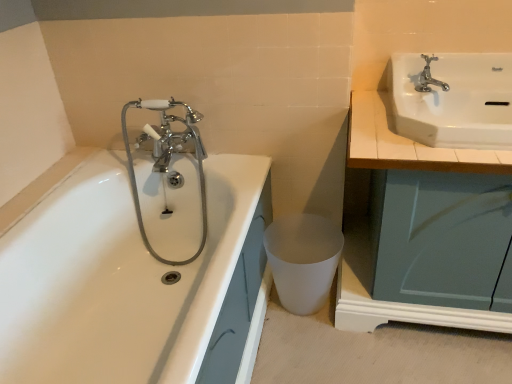
Measure the distance between point (356, 146) and camera.

Point (356, 146) and camera are 1.18 meters apart from each other.

At what (x,y) coordinates should I click in order to perform the action: click on white wood countertop at upper right. Please return your answer as a coordinate pair (x, y). Looking at the image, I should click on (406, 144).

This screenshot has width=512, height=384. In order to click on white matte plastic at lower center in this screenshot , I will do `click(303, 260)`.

Measure the distance between white glossy bathtub at left and camera.

They are 32.67 inches apart.

This screenshot has height=384, width=512. Describe the element at coordinates (139, 267) in the screenshot. I see `white glossy bathtub at left` at that location.

You are a GUI agent. You are given a task and a screenshot of the screen. Output one action in this format:
    pyautogui.click(x=<x>, y=<y>)
    Task: Click on the chrome metallic faucet at upper right
    
    Given the screenshot: What is the action you would take?
    pyautogui.click(x=429, y=77)

Find the location of a particular element. chrome/metallic faucet at left is located at coordinates (168, 159).

Locate an element on the screen. The image size is (512, 384). white wood countertop at upper right is located at coordinates (406, 144).

Is the surface of chrome metallic faucet at upper right in direct contact with white glossy sink at upper right?

There is a gap between chrome metallic faucet at upper right and white glossy sink at upper right.

Which is more distant, (415, 88) or (404, 80)?

The point (404, 80) is behind.

From a real-world perspective, is chrome metallic faucet at upper right located beneath white glossy sink at upper right?

Actually, chrome metallic faucet at upper right is physically above white glossy sink at upper right in the real world.

Relative to white glossy sink at upper right, is chrome metallic faucet at upper right in front or behind?

Visually, chrome metallic faucet at upper right is located behind white glossy sink at upper right.

Is chrome/metallic faucet at left closer to the viewer compared to white matte plastic at lower center?

Yes, it is.

From a real-world perspective, who is located higher, chrome/metallic faucet at left or white matte plastic at lower center?

chrome/metallic faucet at left is physically above.

From the image's perspective, which is above, chrome/metallic faucet at left or white matte plastic at lower center?

chrome/metallic faucet at left, from the image's perspective.

Image resolution: width=512 pixels, height=384 pixels. Find the location of `bathtub located in front of the white wood countertop at upper right`. bathtub located in front of the white wood countertop at upper right is located at coordinates (139, 267).

Can you confirm if white glossy bathtub at left is bigger than white wood countertop at upper right?

Yes.

Can you confirm if white glossy bathtub at left is positioned to the right of white wood countertop at upper right?

No, white glossy bathtub at left is not to the right of white wood countertop at upper right.

Between point (49, 212) and point (383, 312), which one is positioned in front?

The point (49, 212) is closer to the camera.

From their relative heights in the image, would you say white glossy bathtub at left is taller or shorter than white matte plastic at lower center?

In the image, white glossy bathtub at left appears to be taller than white matte plastic at lower center.

Is white glossy bathtub at left in contact with white matte plastic at lower center?

No.

From the image's perspective, is white glossy bathtub at left located above or below white matte plastic at lower center?

From the image's perspective, white glossy bathtub at left appears below white matte plastic at lower center.

From a real-world perspective, is white glossy bathtub at left physically located above or below white matte plastic at lower center?

white glossy bathtub at left is situated higher than white matte plastic at lower center in the real world.

Which of these two, white matte plastic at lower center or white wood countertop at upper right, is smaller?

With smaller size is white matte plastic at lower center.

From a real-world perspective, does white matte plastic at lower center stand above white wood countertop at upper right?

No, from a real-world perspective, white matte plastic at lower center is not above white wood countertop at upper right.

Considering their positions, is white matte plastic at lower center located in front of or behind white wood countertop at upper right?

white matte plastic at lower center is behind white wood countertop at upper right.

From the image's perspective, which is below, white matte plastic at lower center or white wood countertop at upper right?

From the image's view, white matte plastic at lower center is below.

Is white wood countertop at upper right inside the boundaries of white glossy sink at upper right, or outside?

white wood countertop at upper right is not inside white glossy sink at upper right, it's outside.

Which is more to the right, white wood countertop at upper right or white glossy sink at upper right?

Positioned to the right is white wood countertop at upper right.

Could you tell me if white wood countertop at upper right is facing white glossy sink at upper right?

No.

In the scene shown: From a real-world perspective, is white wood countertop at upper right located beneath chrome metallic faucet at upper right?

Yes.

Is white wood countertop at upper right far from chrome metallic faucet at upper right?

Actually, white wood countertop at upper right and chrome metallic faucet at upper right are a little close together.

You are a GUI agent. You are given a task and a screenshot of the screen. Output one action in this format:
    pyautogui.click(x=<x>, y=<y>)
    Task: Click on the counter top located in front of the chrome metallic faucet at upper right
    
    Given the screenshot: What is the action you would take?
    pyautogui.click(x=406, y=144)

There is a white glossy sink at upper right. Identify the location of tap above it (from a real-world perspective). (429, 77).

The image size is (512, 384). Find the location of `toilet bowl that is below the chrome/metallic faucet at left (from the image's perspective)`. toilet bowl that is below the chrome/metallic faucet at left (from the image's perspective) is located at coordinates (303, 260).

Based on their spatial positions, is chrome metallic faucet at upper right or white glossy bathtub at left further from chrome/metallic faucet at left?

chrome metallic faucet at upper right lies further to chrome/metallic faucet at left than the other object.

When comparing their distances from chrome metallic faucet at upper right, does white wood countertop at upper right or chrome/metallic faucet at left seem closer?

white wood countertop at upper right is positioned closer to the anchor chrome metallic faucet at upper right.

From the image, which object appears to be nearer to white glossy sink at upper right, chrome metallic faucet at upper right or white wood countertop at upper right?

chrome metallic faucet at upper right is positioned closer to the anchor white glossy sink at upper right.

Which object lies further to the anchor point white glossy bathtub at left, white matte plastic at lower center or white wood countertop at upper right?

Among the two, white wood countertop at upper right is located further to white glossy bathtub at left.

When comparing their distances from white matte plastic at lower center, does chrome/metallic faucet at left or white glossy sink at upper right seem further?

white glossy sink at upper right is further to white matte plastic at lower center.

Estimate the real-world distances between objects in this image. Which object is closer to white glossy sink at upper right, chrome/metallic faucet at left or white matte plastic at lower center?

white matte plastic at lower center lies closer to white glossy sink at upper right than the other object.

Considering their positions, is chrome metallic faucet at upper right positioned closer to white glossy bathtub at left than white matte plastic at lower center?

white matte plastic at lower center.

Estimate the real-world distances between objects in this image. Which object is further from chrome metallic faucet at upper right, white glossy sink at upper right or chrome/metallic faucet at left?

The object further to chrome metallic faucet at upper right is chrome/metallic faucet at left.

This screenshot has height=384, width=512. I want to click on sink located between white glossy bathtub at left and white wood countertop at upper right in the left-right direction, so click(x=452, y=99).

I want to click on tap between chrome/metallic faucet at left and white wood countertop at upper right in the horizontal direction, so click(429, 77).

Locate an element on the screen. tap between white glossy bathtub at left and white glossy sink at upper right from left to right is located at coordinates (429, 77).

You are a GUI agent. You are given a task and a screenshot of the screen. Output one action in this format:
    pyautogui.click(x=<x>, y=<y>)
    Task: Click on the plumbing fixture positioned between white glossy bathtub at left and white matte plastic at lower center from near to far
    The height and width of the screenshot is (384, 512).
    Given the screenshot: What is the action you would take?
    pyautogui.click(x=168, y=159)